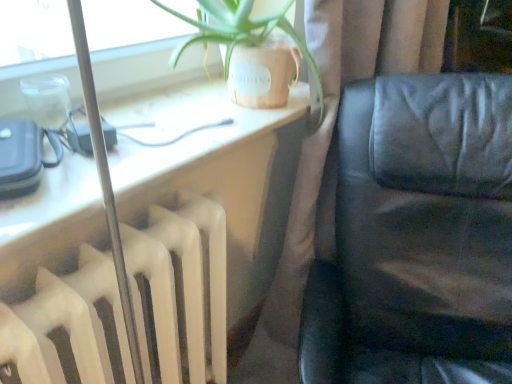
Image resolution: width=512 pixels, height=384 pixels. What do you see at coordinates (203, 218) in the screenshot? I see `matte black leather couch at right` at bounding box center [203, 218].

Describe the element at coordinates (180, 287) in the screenshot. I see `white matte radiator at left` at that location.

What is the approximate width of black leather couch at right?

The width of black leather couch at right is 73.54 centimeters.

Identify the location of brown fabric curtain at center. (333, 153).

In the image, is white matte radiator at left on the left side or the right side of black leather couch at right?

white matte radiator at left is positioned on black leather couch at right's left side.

In the image, there is a white matte radiator at left. Identify the location of furniture above it (from the image's perspective). (417, 237).

Considering the sizes of objects white matte radiator at left and black leather couch at right in the image provided, who is bigger, white matte radiator at left or black leather couch at right?

With larger size is black leather couch at right.

From the image's perspective, between brown fabric curtain at center and matte black leather couch at right, who is located below?

matte black leather couch at right.

Image resolution: width=512 pixels, height=384 pixels. What are the coordinates of `curtain lying above the matte black leather couch at right (from the image's perspective)` in the screenshot? It's located at (333, 153).

Is brown fabric curtain at center smaller than matte black leather couch at right?

Incorrect, brown fabric curtain at center is not smaller in size than matte black leather couch at right.

From the image's perspective, between white matte radiator at left and brown fabric curtain at center, who is located below?

white matte radiator at left is shown below in the image.

In terms of width, does white matte radiator at left look wider or thinner when compared to brown fabric curtain at center?

In the image, white matte radiator at left appears to be more narrow than brown fabric curtain at center.

From a real-world perspective, which object rests below the other?

In real-world perspective, white matte radiator at left is lower.

Which point is more forward, (27,364) or (361,52)?

Point (27,364)

Is point (82, 337) positioned behind point (187, 316)?

No, (82, 337) is closer to viewer.

Considering the relative sizes of matte black leather couch at right and white matte radiator at left in the image provided, is matte black leather couch at right wider than white matte radiator at left?

Yes.

Considering the positions of objects matte black leather couch at right and white matte radiator at left in the image provided, who is more to the left, matte black leather couch at right or white matte radiator at left?

Positioned to the left is white matte radiator at left.

Which of these two, matte black leather couch at right or white matte radiator at left, is bigger?

With larger size is matte black leather couch at right.

Considering the sizes of matte black leather couch at right and black leather couch at right in the image, is matte black leather couch at right bigger or smaller than black leather couch at right?

Clearly, matte black leather couch at right is smaller in size than black leather couch at right.

Is matte black leather couch at right oriented towards black leather couch at right?

Yes, matte black leather couch at right is turned towards black leather couch at right.

Is matte black leather couch at right positioned behind black leather couch at right?

No, matte black leather couch at right is closer to the camera.

Based on the photo, which object is positioned more to the right, matte black leather couch at right or black leather couch at right?

black leather couch at right is more to the right.

Locate an element on the screen. Image resolution: width=512 pixels, height=384 pixels. radiator located underneath the brown fabric curtain at center (from a real-world perspective) is located at coordinates (180, 287).

Is brown fabric curtain at center outside of white matte radiator at left?

brown fabric curtain at center is positioned outside white matte radiator at left.

Could you tell me if brown fabric curtain at center is facing white matte radiator at left?

No, brown fabric curtain at center is not facing towards white matte radiator at left.

From the image's perspective, is black leather couch at right located beneath white matte radiator at left?

No, from the image's perspective, black leather couch at right is not beneath white matte radiator at left.

This screenshot has width=512, height=384. I want to click on furniture that is above the white matte radiator at left (from the image's perspective), so click(x=417, y=237).

Is point (411, 152) farther from camera compared to point (56, 341)?

That is True.

Where is `radiator below the black leather couch at right (from a real-world perspective)`? Image resolution: width=512 pixels, height=384 pixels. radiator below the black leather couch at right (from a real-world perspective) is located at coordinates (180, 287).

You are a GUI agent. You are given a task and a screenshot of the screen. Output one action in this format:
    pyautogui.click(x=<x>, y=<y>)
    Task: Click on the curtain above the matte black leather couch at right (from the image's perspective)
    
    Given the screenshot: What is the action you would take?
    pyautogui.click(x=333, y=153)

When comparing their distances from matte black leather couch at right, does black leather couch at right or white matte radiator at left seem further?

black leather couch at right is further to matte black leather couch at right.

Which object lies nearer to the anchor point matte black leather couch at right, white matte radiator at left or brown fabric curtain at center?

white matte radiator at left.

Which object lies further to the anchor point black leather couch at right, brown fabric curtain at center or white matte radiator at left?

Based on the image, white matte radiator at left appears to be further to black leather couch at right.

Considering their positions, is black leather couch at right positioned closer to white matte radiator at left than matte black leather couch at right?

matte black leather couch at right.

Looking at the image, which one is located further to brown fabric curtain at center, black leather couch at right or matte black leather couch at right?

matte black leather couch at right is positioned further to the anchor brown fabric curtain at center.

Looking at the image, which one is located further to black leather couch at right, brown fabric curtain at center or matte black leather couch at right?

matte black leather couch at right lies further to black leather couch at right than the other object.

Looking at the image, which one is located closer to black leather couch at right, matte black leather couch at right or white matte radiator at left?

matte black leather couch at right is positioned closer to the anchor black leather couch at right.

Looking at the image, which one is located closer to white matte radiator at left, matte black leather couch at right or brown fabric curtain at center?

Among the two, matte black leather couch at right is located nearer to white matte radiator at left.

At what (x,y) coordinates should I click in order to perform the action: click on computer desk between white matte radiator at left and brown fabric curtain at center. Please return your answer as a coordinate pair (x, y). This screenshot has width=512, height=384. Looking at the image, I should click on click(203, 218).

This screenshot has width=512, height=384. Identify the location of computer desk situated between white matte radiator at left and black leather couch at right from left to right. (203, 218).

Where is `curtain between matte black leather couch at right and black leather couch at right`? Image resolution: width=512 pixels, height=384 pixels. curtain between matte black leather couch at right and black leather couch at right is located at coordinates (333, 153).

Where is `curtain between white matte radiator at left and black leather couch at right from left to right`? curtain between white matte radiator at left and black leather couch at right from left to right is located at coordinates (333, 153).